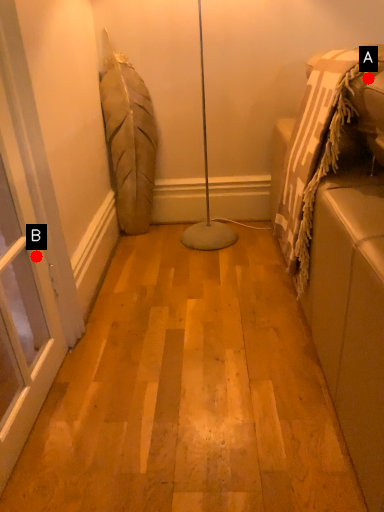
Question: Two points are circled on the image, labeled by A and B beside each circle. Which point appears closest to the camera in this image?

Choices:
 (A) A is closer
 (B) B is closer

Answer: (A)